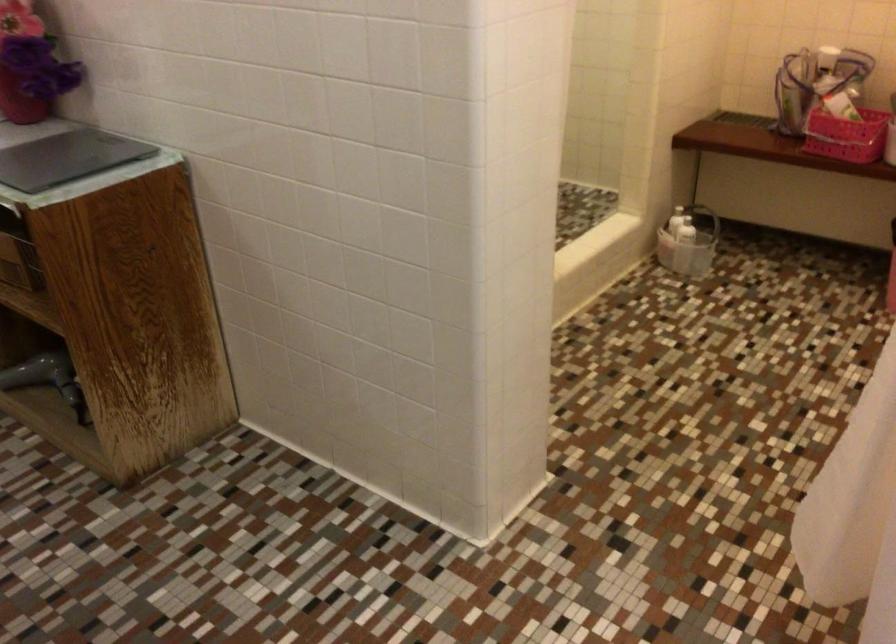
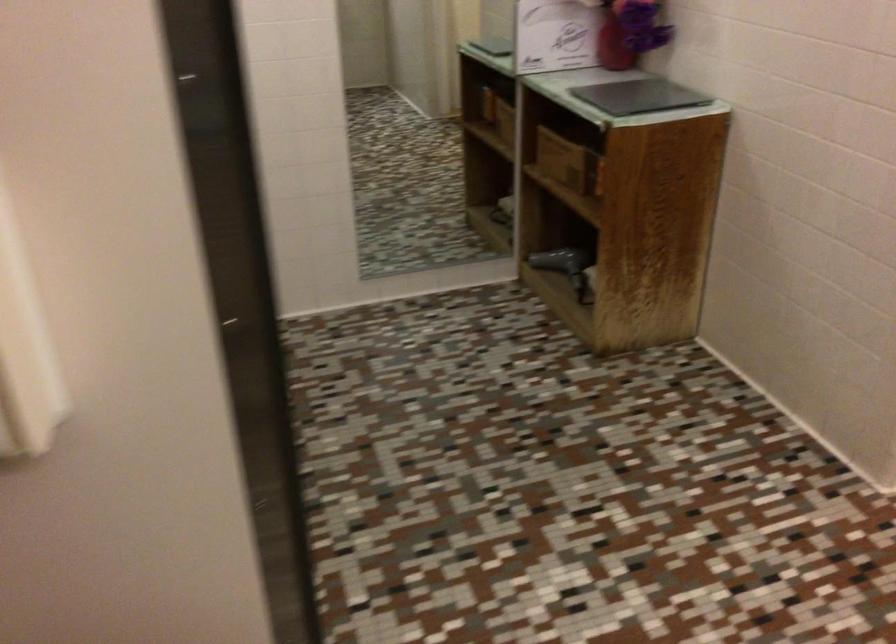
Locate, in the second image, the point that corresponds to the point at 85,308 in the first image.

(616, 207)